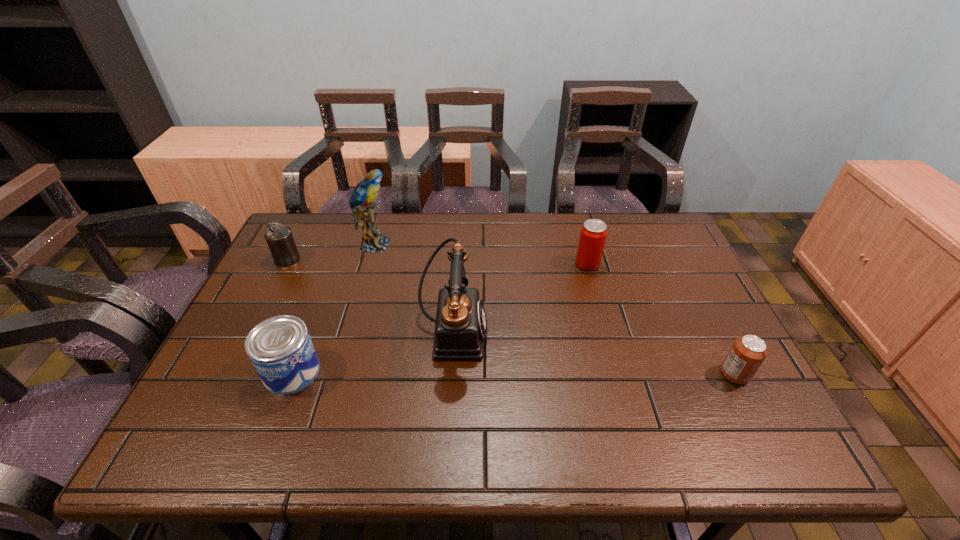
Locate an element on the screen. The height and width of the screenshot is (540, 960). vacant area at the far left corner is located at coordinates (326, 231).

The image size is (960, 540). In order to click on vacant area that lies between the parrot and the leftmost can in this screenshot , I will do `click(330, 252)`.

The height and width of the screenshot is (540, 960). Identify the location of vacant point located between the rightmost object and the parrot. click(555, 309).

Identify the location of vacant area that lies between the fifth shortest object and the tallest object. (414, 288).

Locate an element on the screen. unoccupied area between the leftmost can and the tallest object is located at coordinates (330, 252).

Identify the location of free space between the rightmost object and the second can from left to right. (514, 373).

This screenshot has width=960, height=540. What are the coordinates of `free spot between the rightmost can and the tallest object` in the screenshot? It's located at (555, 309).

You are a GUI agent. You are given a task and a screenshot of the screen. Output one action in this format:
    pyautogui.click(x=<x>, y=<y>)
    Task: Click on the vacant space in between the leftmost object and the second can from left to right
    The height and width of the screenshot is (540, 960).
    Given the screenshot: What is the action you would take?
    pyautogui.click(x=290, y=315)

Locate an element on the screen. The image size is (960, 540). empty space between the rightmost object and the parrot is located at coordinates (555, 309).

The height and width of the screenshot is (540, 960). Find the location of `free area in between the second can from right to left and the tallest object`. free area in between the second can from right to left and the tallest object is located at coordinates (481, 254).